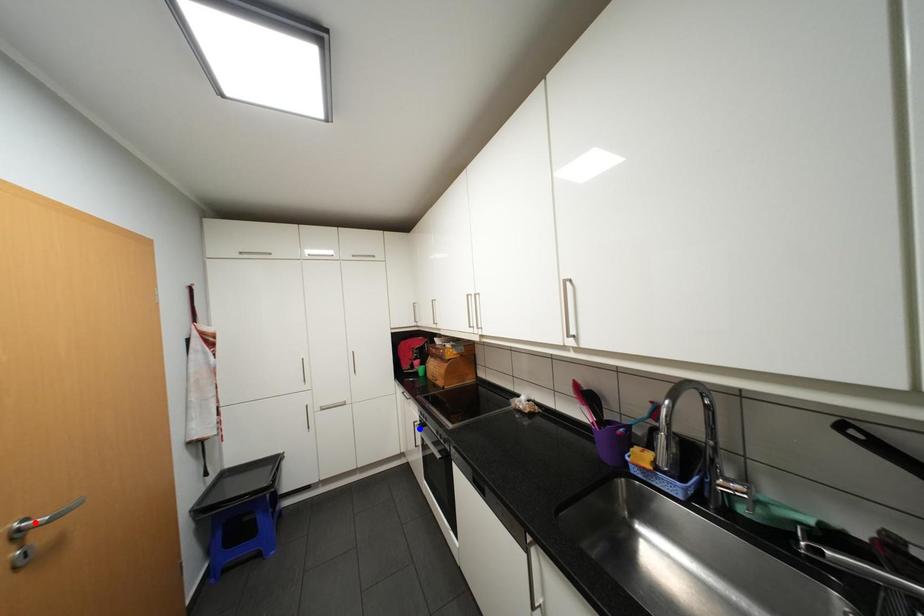
Question: Which of the two points in the image is closer to the camera?

Choices:
 (A) Blue point is closer.
 (B) Red point is closer.

Answer: (B)